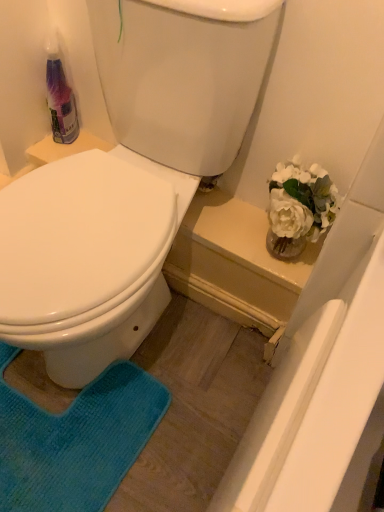
Question: Looking at their shapes, would you say white glossy toilet at center is wider or thinner than translucent plastic bottle at upper left?

Choices:
 (A) thin
 (B) wide

Answer: (B)

Question: Is white glossy toilet at center to the left or to the right of translucent plastic bottle at upper left in the image?

Choices:
 (A) right
 (B) left

Answer: (A)

Question: Which object is the closest to the blue textured rug at lower left?

Choices:
 (A) translucent plastic bottle at upper left
 (B) white glossy toilet at center

Answer: (B)

Question: Which is nearer to the translucent plastic bottle at upper left?

Choices:
 (A) white glossy toilet at center
 (B) blue textured rug at lower left

Answer: (A)